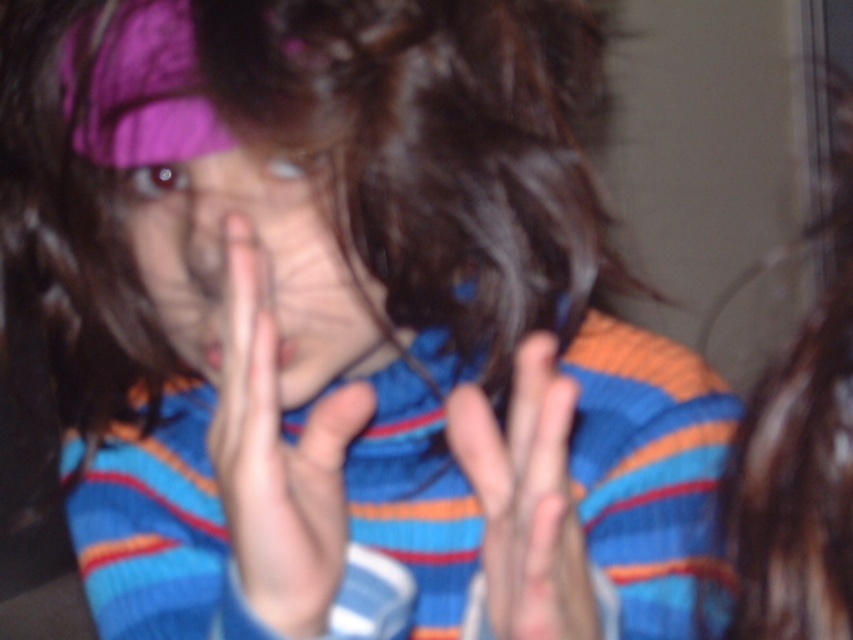
The image size is (853, 640). In order to click on matte purple headband at center in this screenshot , I will do pos(248,268).

Is point (381, 298) closer to viewer compared to point (838, 616)?

That is False.

At what (x,y) coordinates should I click in order to perform the action: click on matte purple headband at center. Please return your answer as a coordinate pair (x, y). Looking at the image, I should click on pos(248,268).

Between point (344, 401) and point (482, 419), which one is positioned behind?

Point (344, 401)

Measure the distance between smooth skin hands at center and smooth skin hand at center.

The distance of smooth skin hands at center from smooth skin hand at center is 2.35 inches.

This screenshot has width=853, height=640. I want to click on smooth skin hands at center, so click(x=277, y=458).

The image size is (853, 640). Identify the location of smooth skin hands at center. click(277, 458).

Based on the photo, does brown shiny hair at right appear over smooth skin hand at center?

Yes.

Can you confirm if brown shiny hair at right is wider than smooth skin hand at center?

Yes, brown shiny hair at right is wider than smooth skin hand at center.

This screenshot has height=640, width=853. I want to click on brown shiny hair at right, so click(802, 445).

At what (x,y) coordinates should I click in order to perform the action: click on brown shiny hair at right. Please return your answer as a coordinate pair (x, y). Image resolution: width=853 pixels, height=640 pixels. Looking at the image, I should click on (802, 445).